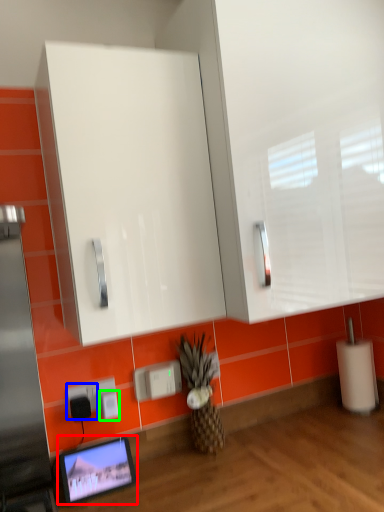
Question: Which is farther away from computer monitor (highlighted by a red box)? electric outlet (highlighted by a blue box) or electric outlet (highlighted by a green box)?

Choices:
 (A) electric outlet
 (B) electric outlet

Answer: (B)